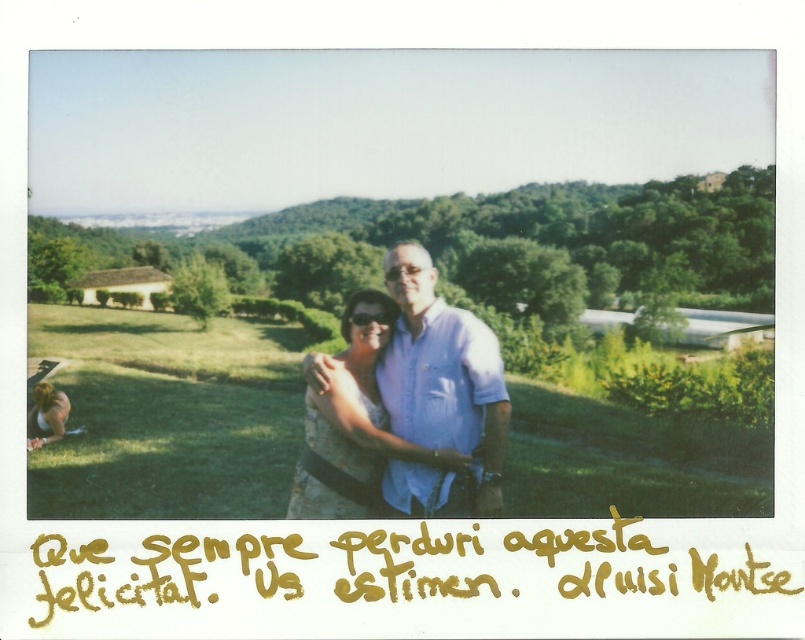
Question: Observing the image, what is the correct spatial positioning of matte blue shirt at center in reference to matte white dress at lower left?

Choices:
 (A) above
 (B) below

Answer: (A)

Question: Which object is closer to the camera taking this photo?

Choices:
 (A) matte white dress at lower left
 (B) matte blue shirt at center

Answer: (B)

Question: Is matte blue shirt at center in front of matte white dress at lower left?

Choices:
 (A) no
 (B) yes

Answer: (B)

Question: Does matte blue shirt at center have a lesser width compared to matte white dress at lower left?

Choices:
 (A) no
 (B) yes

Answer: (A)

Question: Which point is farther to the camera?

Choices:
 (A) matte white dress at lower left
 (B) matte blue shirt at center

Answer: (A)